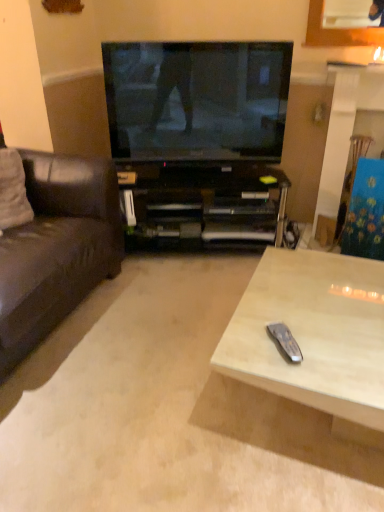
This screenshot has width=384, height=512. I want to click on vacant area in front of black plastic cabinet at center, so click(x=171, y=297).